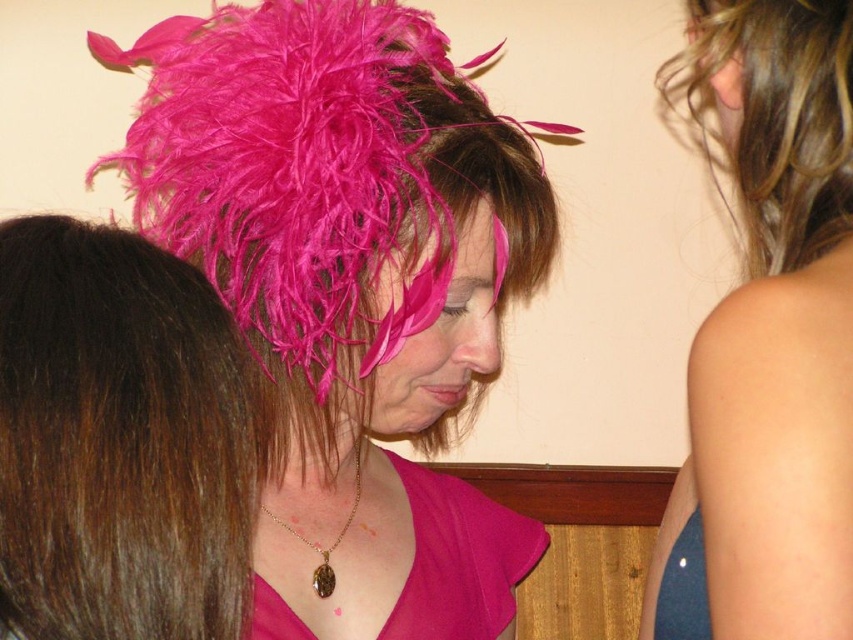
Is point (223, 474) closer to camera compared to point (776, 260)?

Yes, it is.

Does brown smooth hair at left appear on the right side of blonde curly hair at upper right?

Incorrect, brown smooth hair at left is not on the right side of blonde curly hair at upper right.

Is point (49, 436) positioned behind point (697, 108)?

No, it is in front of (697, 108).

I want to click on brown smooth hair at left, so click(x=119, y=440).

Between smooth blue dress at right and brown smooth hair at left, which one has less height?

Standing shorter between the two is brown smooth hair at left.

Who is taller, smooth blue dress at right or brown smooth hair at left?

Standing taller between the two is smooth blue dress at right.

Who is more distant from viewer, (840, 492) or (219, 404)?

The point (840, 492) is behind.

This screenshot has height=640, width=853. Identify the location of smooth blue dress at right. (769, 337).

Is blonde curly hair at upper right positioned behind pink satin dress at center?

Yes, it is behind pink satin dress at center.

Where is `blonde curly hair at upper right`? The width and height of the screenshot is (853, 640). blonde curly hair at upper right is located at coordinates (776, 116).